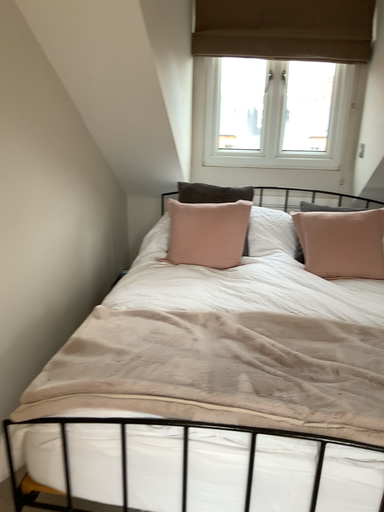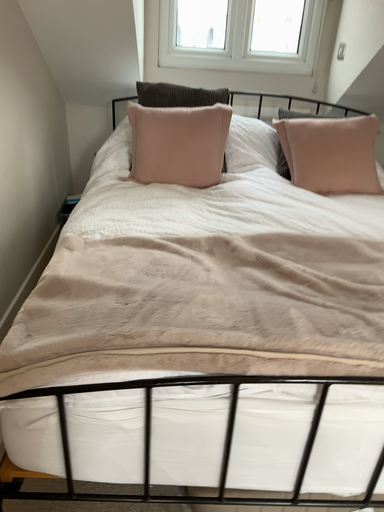
Question: How did the camera likely rotate when shooting the video?

Choices:
 (A) rotated left
 (B) rotated right

Answer: (B)